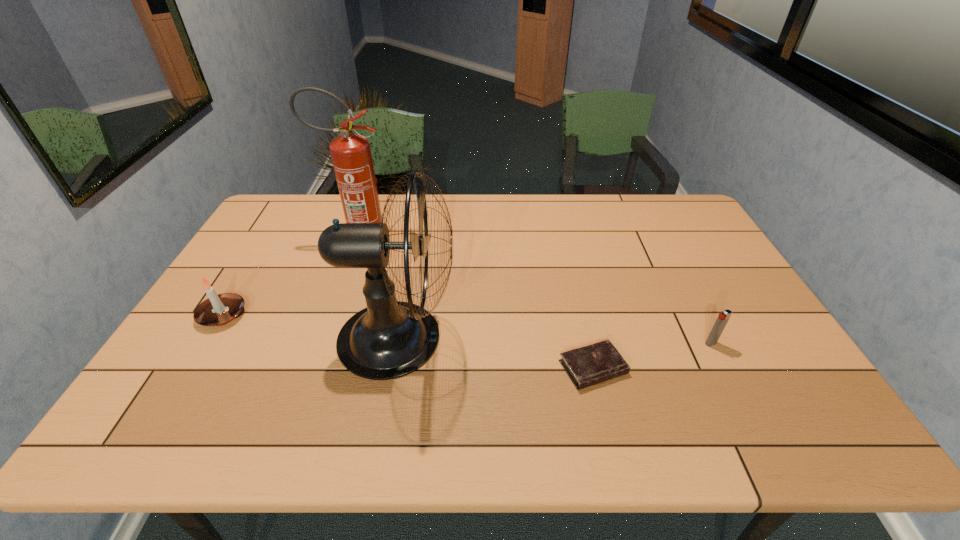
Locate an element on the screen. The height and width of the screenshot is (540, 960). free point between the leftmost object and the fan is located at coordinates (310, 327).

Find the location of `free space between the third tallest object and the fire extinguisher`. free space between the third tallest object and the fire extinguisher is located at coordinates (291, 277).

Identify the location of free space between the fan and the second shortest object. (554, 341).

At what (x,y) coordinates should I click in order to perform the action: click on free space between the fourth tallest object and the fan. Please return your answer as a coordinate pair (x, y). The image size is (960, 540). Looking at the image, I should click on (554, 341).

Where is `vacant area that lies between the farthest object and the second shortest object`? This screenshot has height=540, width=960. vacant area that lies between the farthest object and the second shortest object is located at coordinates (535, 291).

Identify which object is the closest to the fan. Please provide its 2D coordinates. Your answer should be formatted as a tuple, i.e. [(x, y)], where the tuple contains the x and y coordinates of a point satisfying the conditions above.

[(351, 156)]

Select which object is the third closest to the second shortest object. Please provide its 2D coordinates. Your answer should be formatted as a tuple, i.e. [(x, y)], where the tuple contains the x and y coordinates of a point satisfying the conditions above.

[(351, 156)]

At what (x,y) coordinates should I click in order to perform the action: click on blank space that satisfies the following two spatial constraints: 1. on the back side of the fourth tallest object; 2. on the left side of the shortest object. Please return your answer as a coordinate pair (x, y). The image size is (960, 540). Looking at the image, I should click on (588, 343).

This screenshot has height=540, width=960. Find the location of `vacant space that satisfies the following two spatial constraints: 1. on the back side of the shortest object; 2. from the nozzle of the farthest object`. vacant space that satisfies the following two spatial constraints: 1. on the back side of the shortest object; 2. from the nozzle of the farthest object is located at coordinates (563, 239).

Identify the location of free region that satisfies the following two spatial constraints: 1. on the front-facing side of the fan; 2. on the right side of the second shortest object. Image resolution: width=960 pixels, height=540 pixels. (396, 343).